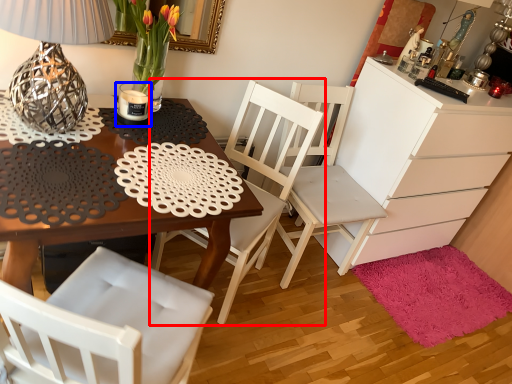
Question: Which object appears closest to the camera in this image, chair (highlighted by a red box) or candle holder (highlighted by a blue box)?

Choices:
 (A) chair
 (B) candle holder

Answer: (A)